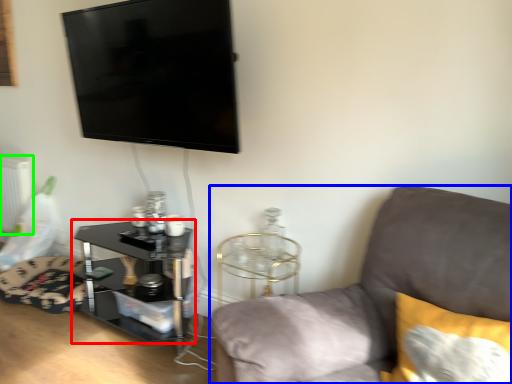
Question: Considering the real-world distances, which object is farthest from table (highlighted by a red box)? studio couch (highlighted by a blue box) or radiator (highlighted by a green box)?

Choices:
 (A) studio couch
 (B) radiator

Answer: (B)